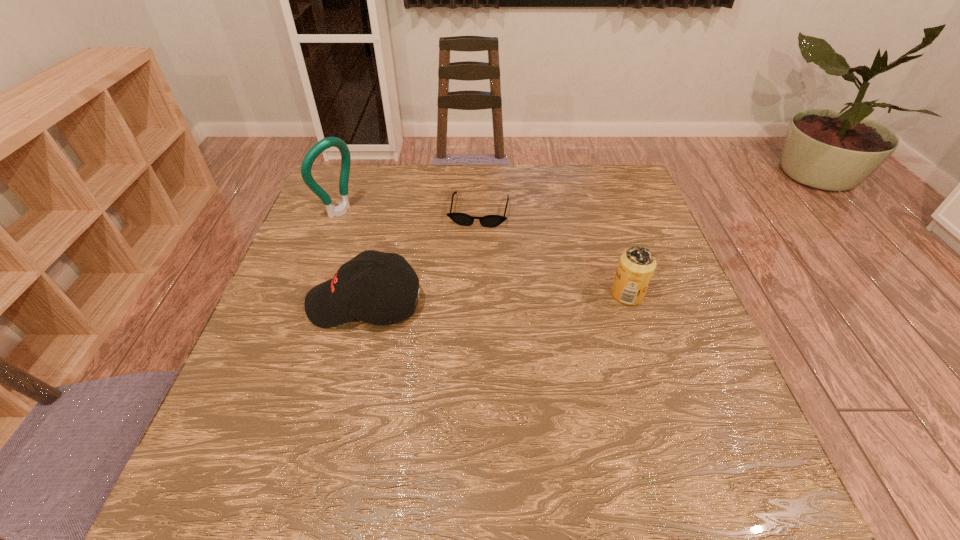
Where is `free point between the baseball cap and the shortest object`? free point between the baseball cap and the shortest object is located at coordinates point(421,258).

Locate an element on the screen. This screenshot has height=540, width=960. blank region between the tallest object and the third object from left to right is located at coordinates (409, 212).

The image size is (960, 540). In order to click on empty space between the baseball cap and the beer can in this screenshot , I will do `click(496, 299)`.

Where is `vacant space that's between the bottle opener and the baseball cap`? This screenshot has height=540, width=960. vacant space that's between the bottle opener and the baseball cap is located at coordinates pyautogui.click(x=352, y=258).

In order to click on unoccupied position between the rightmost object and the second object from right to left in this screenshot , I will do `click(553, 253)`.

Identify the location of free space between the shortest object and the baseball cap. (421, 258).

Locate which object is the second closest to the sunglasses. Please provide its 2D coordinates. Your answer should be formatted as a tuple, i.e. [(x, y)], where the tuple contains the x and y coordinates of a point satisfying the conditions above.

[(341, 209)]

This screenshot has height=540, width=960. What are the coordinates of `object that is the closest one to the sunglasses` in the screenshot? It's located at (348, 296).

Locate an element on the screen. free space that satisfies the following two spatial constraints: 1. on the front side of the bottle opener; 2. on the right side of the beer can is located at coordinates (308, 294).

The height and width of the screenshot is (540, 960). Identify the location of vacant space that satisfies the following two spatial constraints: 1. on the front side of the bottle opener; 2. on the front-facing side of the baseball cap. (305, 303).